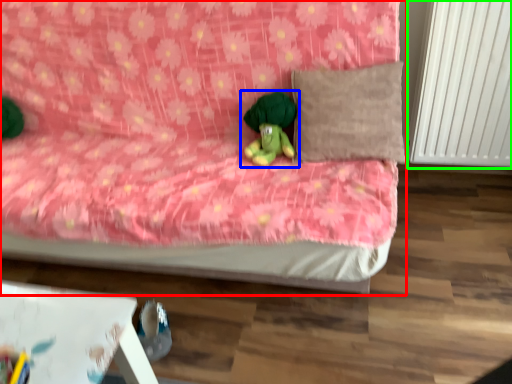
Question: Which is farther away from bed (highlighted by a red box)? toy (highlighted by a blue box) or radiator (highlighted by a green box)?

Choices:
 (A) toy
 (B) radiator

Answer: (B)